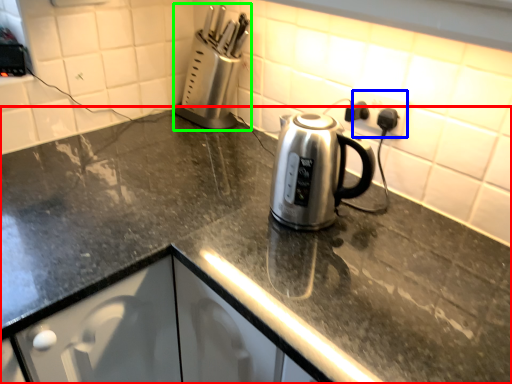
Question: Considering the real-world distances, which object is farthest from countertop (highlighted by a red box)? electric outlet (highlighted by a blue box) or appliance (highlighted by a green box)?

Choices:
 (A) electric outlet
 (B) appliance

Answer: (B)